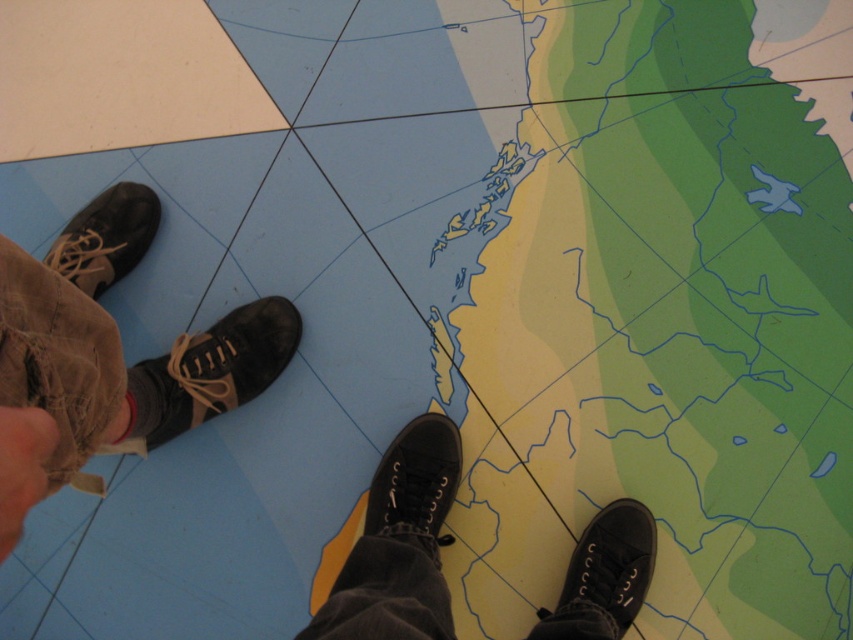
Question: Which object appears farthest from the camera in this image?

Choices:
 (A) green matte map at center
 (B) black leather shoe at center

Answer: (B)

Question: Considering the relative positions of green matte map at center and black leather shoe at lower left in the image provided, where is green matte map at center located with respect to black leather shoe at lower left?

Choices:
 (A) right
 (B) left

Answer: (A)

Question: Does black leather shoe at center have a lesser width compared to black canvas shoe at lower right?

Choices:
 (A) no
 (B) yes

Answer: (A)

Question: In this image, where is brown suede shoes at left located relative to black leather shoe at lower left?

Choices:
 (A) above
 (B) below

Answer: (A)

Question: Which object is positioned closest to the brown suede shoes at left?

Choices:
 (A) black canvas shoe at lower right
 (B) green matte map at center
 (C) black canvas shoes at center

Answer: (C)

Question: Which is nearer to the green matte map at center?

Choices:
 (A) black leather shoe at lower left
 (B) matte black shoe at left
 (C) brown suede shoes at left

Answer: (A)